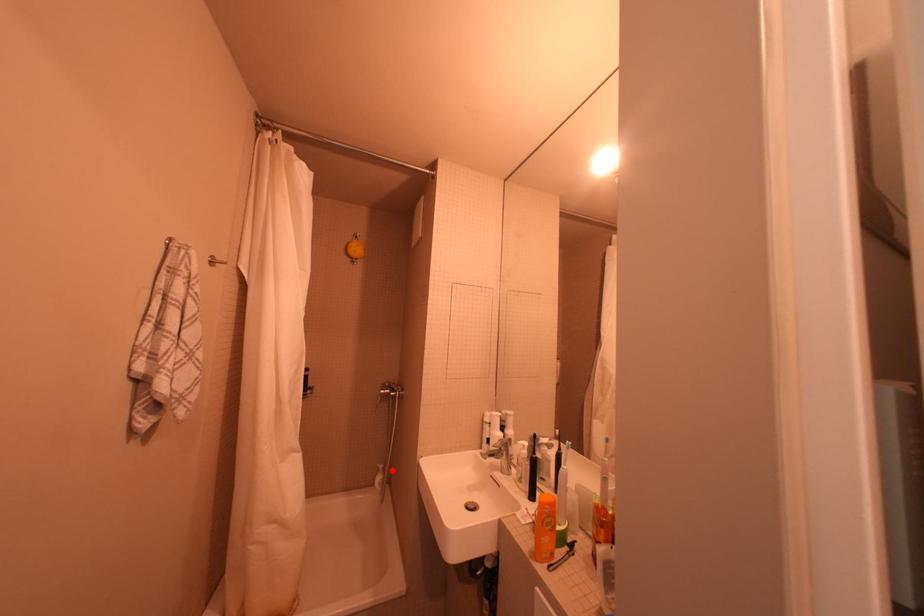
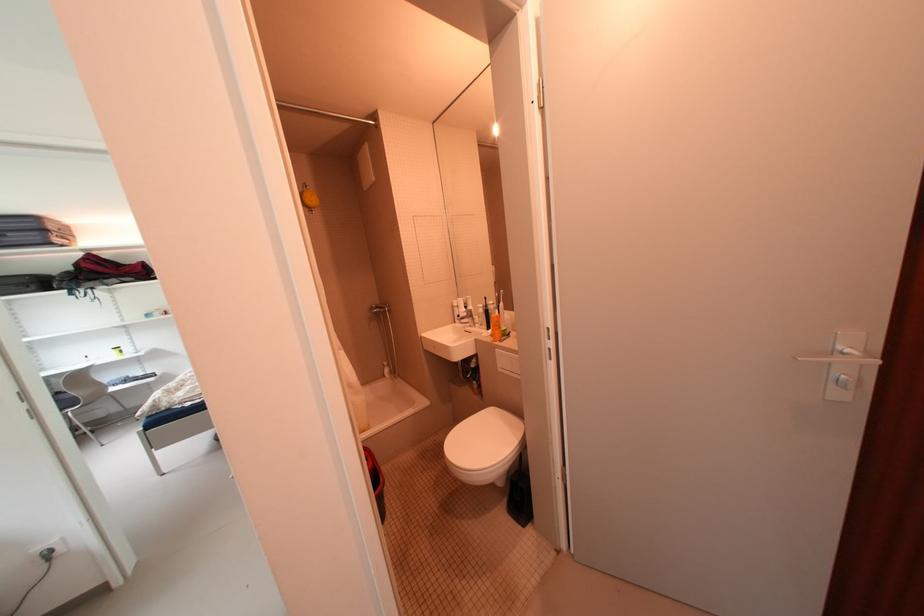
Question: I am providing you with two images of the same scene from different viewpoints. Given a red point in image1, look at the same physical point in image2. Is it:

Choices:
 (A) Closer to the viewpoint
 (B) Farther from the viewpoint

Answer: (A)